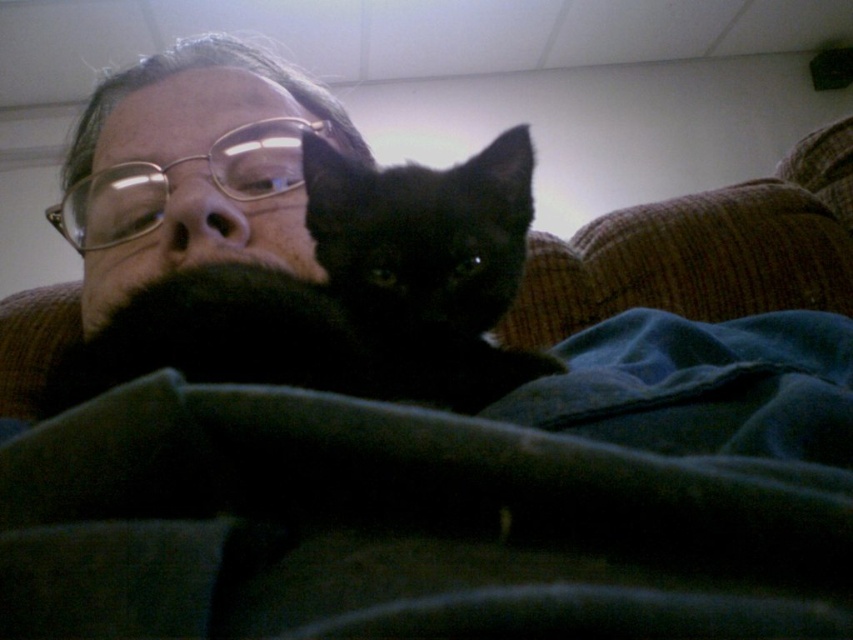
Looking at this image, is black fur cat at center behind matte black beard at center?

No, it is not.

Is black fur cat at center thinner than matte black beard at center?

Yes, black fur cat at center is thinner than matte black beard at center.

Is point (335, 324) positioned behind point (247, 221)?

No, (335, 324) is in front of (247, 221).

At what (x,y) coordinates should I click in order to perform the action: click on black fur cat at center. Please return your answer as a coordinate pair (x, y). This screenshot has height=640, width=853. Looking at the image, I should click on (347, 292).

Is black fur cat at center shorter than brown corduroy couch at upper right?

Yes, black fur cat at center is shorter than brown corduroy couch at upper right.

Who is positioned more to the left, black fur cat at center or brown corduroy couch at upper right?

Positioned to the left is black fur cat at center.

Is point (132, 305) less distant than point (805, 227)?

Yes, it is.

Where is `black fur cat at center`? The image size is (853, 640). black fur cat at center is located at coordinates (347, 292).

Is point (328, 122) farther from viewer compared to point (838, 218)?

No, it is in front of (838, 218).

Between matte black beard at center and brown corduroy couch at upper right, which one has more height?

Standing taller between the two is brown corduroy couch at upper right.

Which is in front, point (10, 305) or point (549, 342)?

Point (549, 342)

At what (x,y) coordinates should I click in order to perform the action: click on matte black beard at center. Please return your answer as a coordinate pair (x, y). The width and height of the screenshot is (853, 640). Looking at the image, I should click on 167,189.